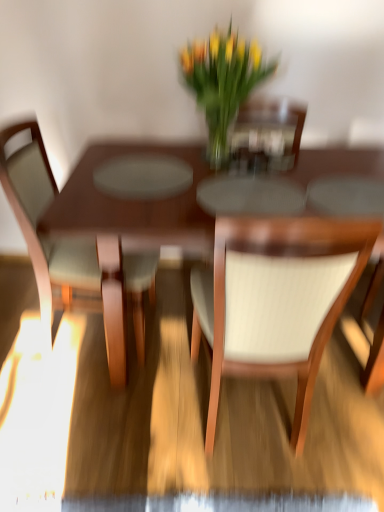
You are a GUI agent. You are given a task and a screenshot of the screen. Output one action in this format:
    pyautogui.click(x=<x>, y=<y>)
    Task: Click on the free space in front of white textured chair at center, which appears as the second chair when viewed from the left
    Image resolution: width=384 pixels, height=512 pixels.
    Given the screenshot: What is the action you would take?
    pyautogui.click(x=254, y=490)